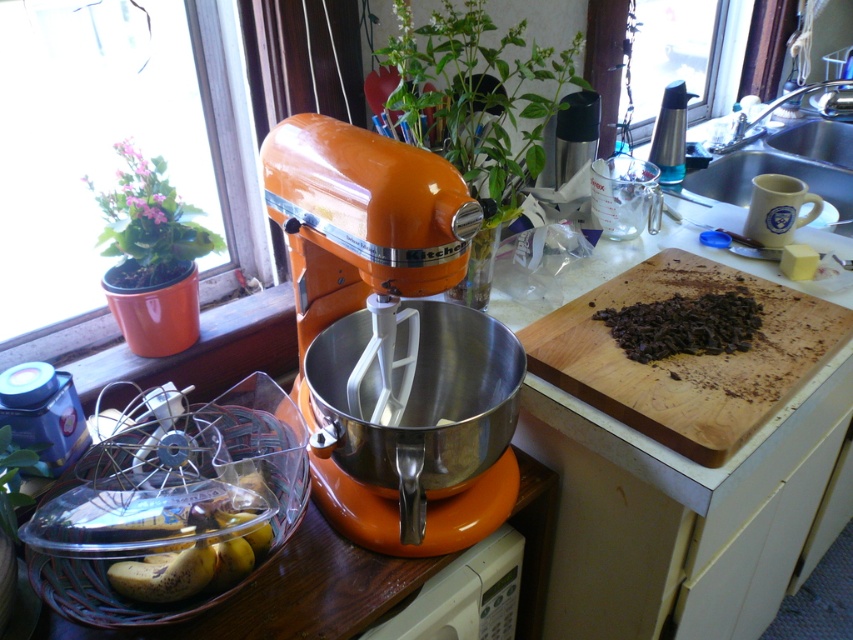
Question: Is orange glossy kitchenaid mixer at center thinner than wooden cutting board at right?

Choices:
 (A) yes
 (B) no

Answer: (A)

Question: Which object appears farthest from the camera in this image?

Choices:
 (A) yellow matte bananas at lower left
 (B) matte black canister at left
 (C) orange plastic stand mixer at center
 (D) orange plastic counter at center

Answer: (C)

Question: Which object is positioned closest to the orange plastic counter at center?

Choices:
 (A) silver metallic sink at upper right
 (B) wooden cutting board at right
 (C) dark chocolate chunks at center
 (D) orange glossy kitchenaid mixer at center

Answer: (B)

Question: Which point is closer to the camera?

Choices:
 (A) (508, 593)
 (B) (135, 588)
 (C) (630, 397)
 (D) (451, 218)

Answer: (D)

Question: Can you confirm if orange glossy kitchenaid mixer at center is positioned below dark chocolate chunks at center?

Choices:
 (A) yes
 (B) no

Answer: (A)

Question: Does wooden cutting board at right have a lesser width compared to matte black canister at left?

Choices:
 (A) yes
 (B) no

Answer: (B)